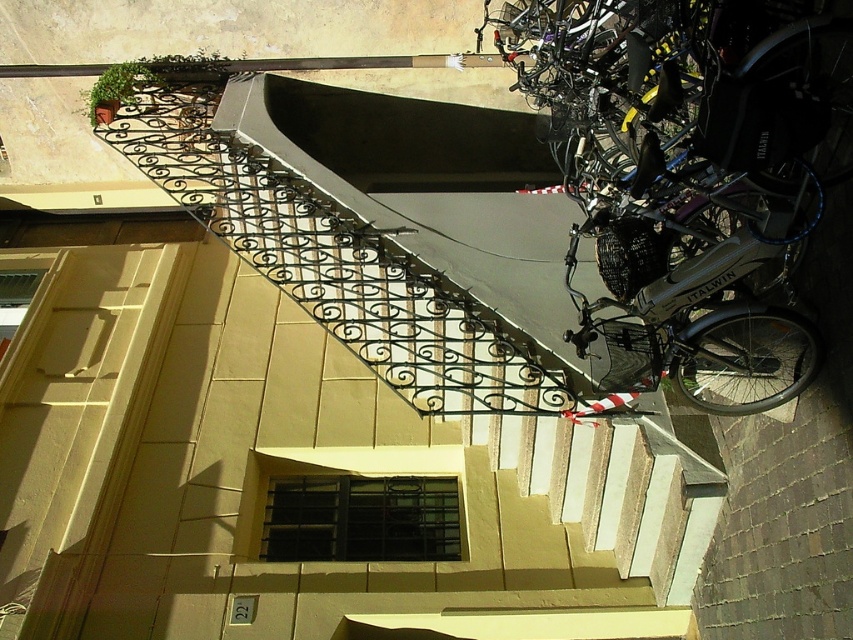
You are standing at the bottom of the smooth concrete stairs at center and want to see the silver metallic bicycle at right. Can you see the entire bicycle without moving your head?

The silver metallic bicycle at right is behind the smooth concrete stairs at center, so you cannot see the entire bicycle without moving your head.

In the scene shown: You are standing at the entrance of the building and want to place a new bench. The bench requires a clear space of 1.2 meters in front of it. Can you place the bench in front of the smooth concrete stairs at center without blocking the stairs?

The smooth concrete stairs at center is located at point (376, 419). Since the bench requires 1.2 meters of clear space, you need to ensure there is enough space in front of the stairs. However, without additional information about the surrounding area or obstacles, it is not possible to determine if the bench can be placed safely without blocking the stairs.